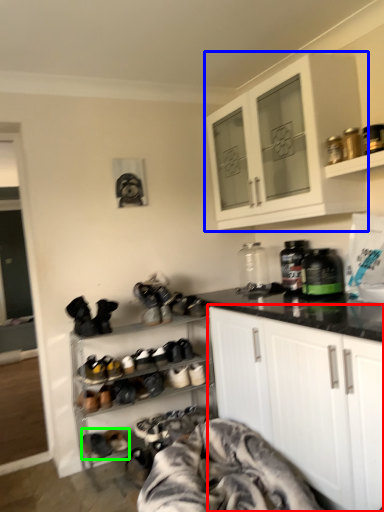
Question: Estimate the real-world distances between objects in this image. Which object is closer to cabinetry (highlighted by a red box), cabinetry (highlighted by a blue box) or footwear (highlighted by a green box)?

Choices:
 (A) cabinetry
 (B) footwear

Answer: (A)